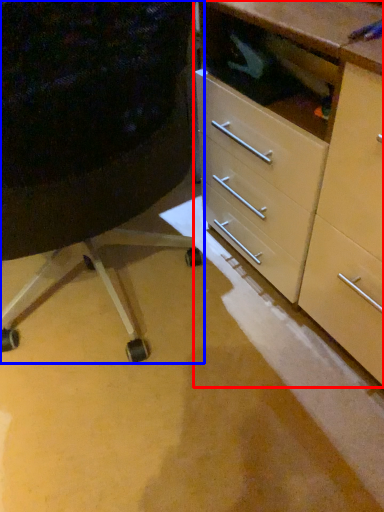
Question: Among these objects, which one is farthest to the camera, chest of drawers (highlighted by a red box) or furniture (highlighted by a blue box)?

Choices:
 (A) chest of drawers
 (B) furniture

Answer: (A)